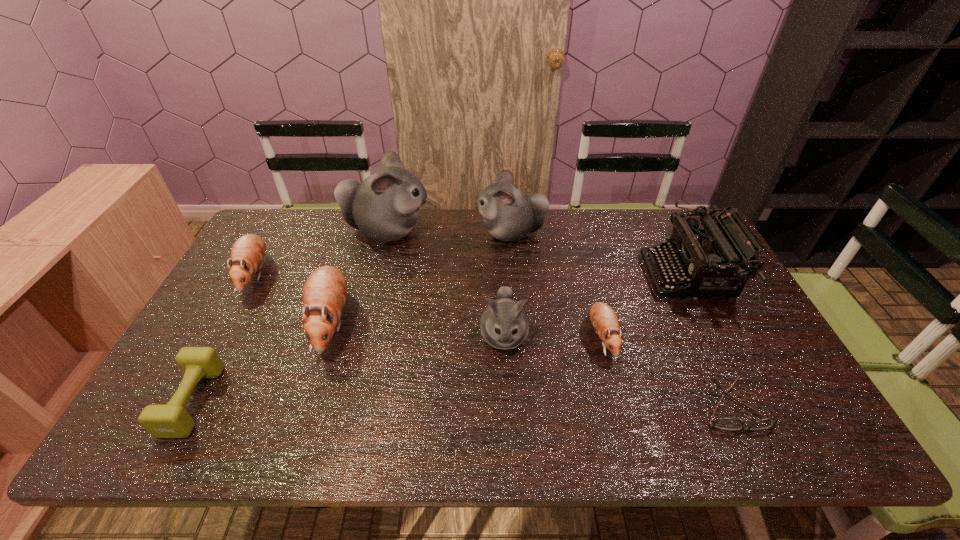
You are a GUI agent. You are given a task and a screenshot of the screen. Output one action in this format:
    pyautogui.click(x=<x>, y=<y>)
    Task: Click on the free space at the far right corner of the desktop
    The height and width of the screenshot is (540, 960).
    Given the screenshot: What is the action you would take?
    pyautogui.click(x=662, y=213)

At what (x,y) coordinates should I click in order to perform the action: click on free spot between the spectacles and the second biggest white hamster. Please return your answer as a coordinate pair (x, y). Image resolution: width=960 pixels, height=540 pixels. Looking at the image, I should click on (621, 320).

Where is `vacant area that lies between the olive dumbbell and the shortest object`? vacant area that lies between the olive dumbbell and the shortest object is located at coordinates (463, 404).

You are a GUI agent. You are given a task and a screenshot of the screen. Output one action in this format:
    pyautogui.click(x=<x>, y=<y>)
    Task: Click on the free space between the smallest white hamster and the third object from right to left
    The width and height of the screenshot is (960, 540).
    Given the screenshot: What is the action you would take?
    pyautogui.click(x=553, y=337)

Identify the location of free space between the second tallest hamster and the smallest brown hamster. (556, 285).

The width and height of the screenshot is (960, 540). Find the location of `free area in between the typewriter and the biggest white hamster`. free area in between the typewriter and the biggest white hamster is located at coordinates (538, 254).

Locate an element on the screen. free area in between the biggest white hamster and the typewriter is located at coordinates (538, 254).

What are the coordinates of `unoccupied position between the second smallest brown hamster and the nearest white hamster` in the screenshot? It's located at (379, 306).

Locate an element on the screen. The image size is (960, 540). free space between the olive dumbbell and the shortest object is located at coordinates (463, 404).

Where is `free point between the tallest object and the spectacles`? The width and height of the screenshot is (960, 540). free point between the tallest object and the spectacles is located at coordinates (560, 319).